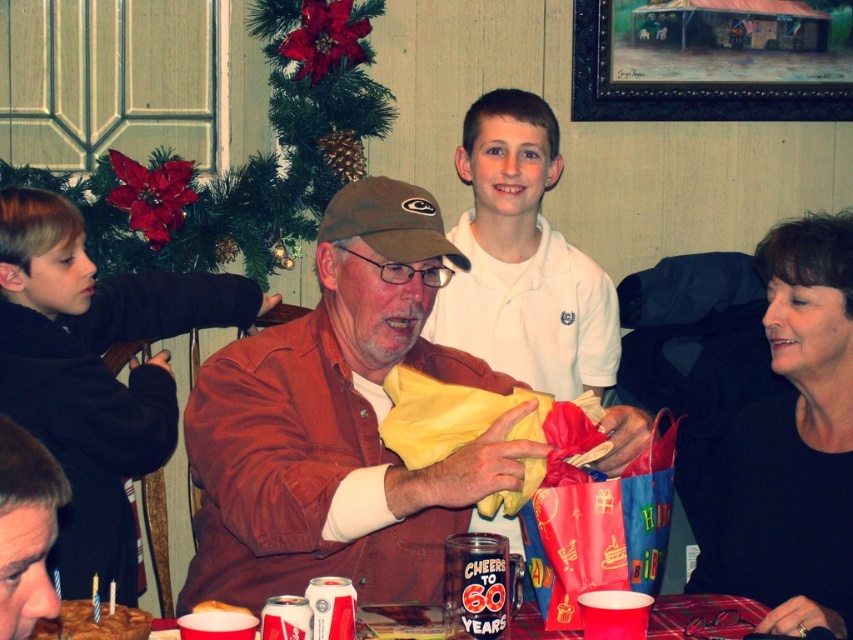
Can you confirm if white smooth shirt at upper center is positioned below chocolate cake with frosting at lower left?

No.

Who is more forward, (511, 304) or (45, 628)?

Positioned in front is point (45, 628).

Between point (517, 349) and point (41, 620), which one is positioned in front?

Point (41, 620) is more forward.

Find the location of a particular element. This screenshot has width=853, height=640. white smooth shirt at upper center is located at coordinates (523, 259).

Which is more to the left, smooth brown leather jacket at lower left or chocolate cake with frosting at lower left?

Positioned to the left is chocolate cake with frosting at lower left.

Is smooth brown leather jacket at lower left above chocolate cake with frosting at lower left?

Indeed, smooth brown leather jacket at lower left is positioned over chocolate cake with frosting at lower left.

What do you see at coordinates (26, 529) in the screenshot?
I see `smooth brown leather jacket at lower left` at bounding box center [26, 529].

Identify the location of smooth brown leather jacket at lower left. This screenshot has height=640, width=853. [x=26, y=529].

Who is positioned more to the left, brown leather jacket at center or chocolate cake with frosting at lower left?

chocolate cake with frosting at lower left

Is brown leather jacket at center to the left of chocolate cake with frosting at lower left from the viewer's perspective?

No, brown leather jacket at center is not to the left of chocolate cake with frosting at lower left.

Locate an element on the screen. The height and width of the screenshot is (640, 853). brown leather jacket at center is located at coordinates (339, 422).